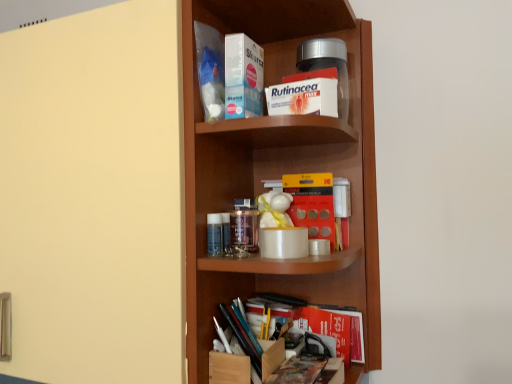
Question: From a real-world perspective, is transparent glass jar at center positioned above or below blue plastic bag at upper center, which is counted as the fifth book, starting from the bottom?

Choices:
 (A) above
 (B) below

Answer: (B)

Question: Considering the positions of transparent glass jar at center and blue plastic bag at upper center, which appears as the first book when viewed from the top, in the image, is transparent glass jar at center bigger or smaller than blue plastic bag at upper center, which appears as the first book when viewed from the top,?

Choices:
 (A) small
 (B) big

Answer: (A)

Question: Considering the real-world distances, which object is closest to the wooden shelf at center?

Choices:
 (A) white cardboard box at upper center, which ranks as the third book in top-to-bottom order
 (B) blue plastic bag at upper center, which is counted as the fifth book, starting from the bottom
 (C) transparent glass jar at center
 (D) yellow matte kodak film at center, arranged as the 2th book when ordered from the bottom
 (E) matte yellow door at left

Answer: (E)

Question: Which object is positioned farthest from the wooden shelf at center?

Choices:
 (A) blue plastic bag at upper center, which appears as the first book when viewed from the top
 (B) red paper book at lower center, positioned as the 1th book in bottom-to-top order
 (C) blue plastic box at upper center, the fourth book when ordered from bottom to top
 (D) transparent glass jar at center
 (E) yellow matte kodak film at center, arranged as the 2th book when ordered from the bottom

Answer: (B)